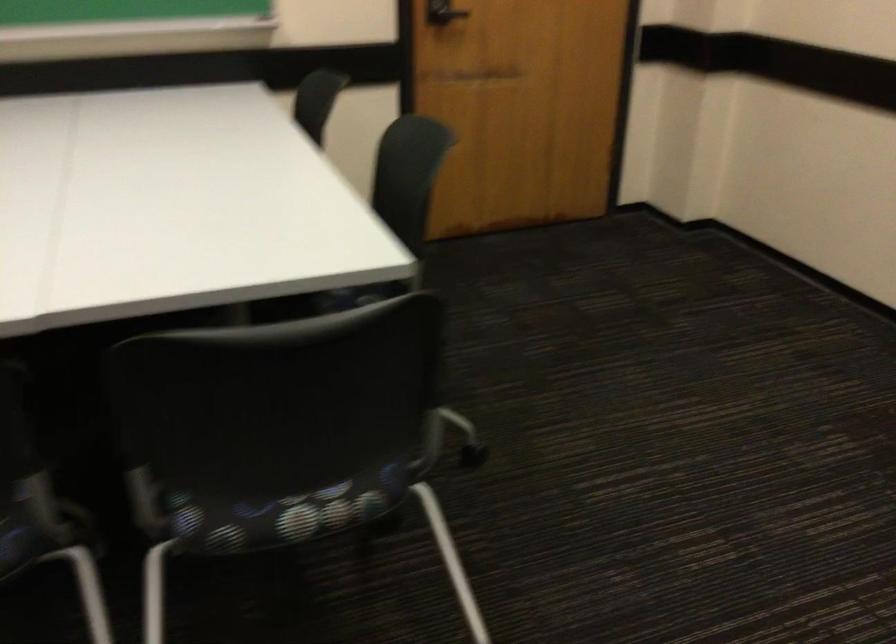
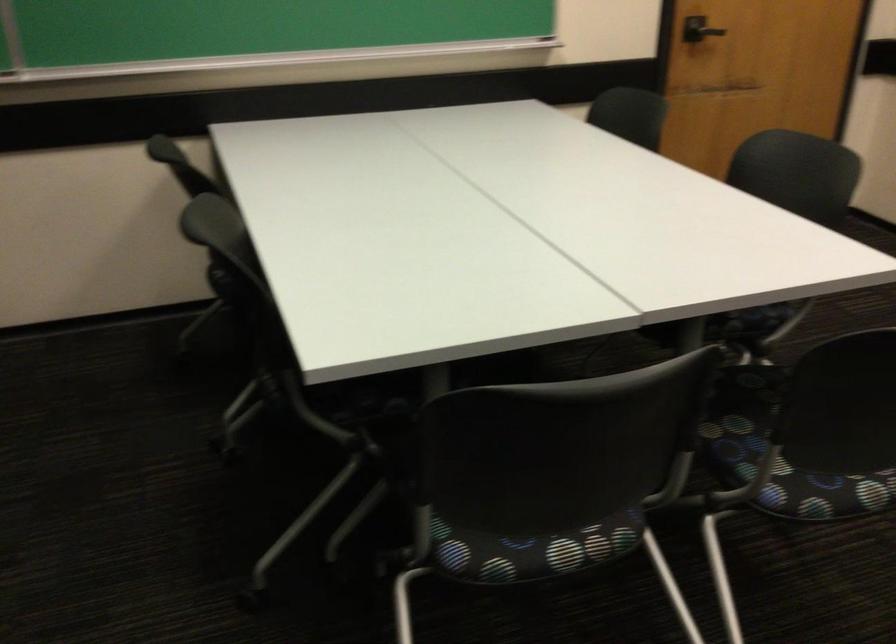
Find the pixel in the second image that matches (245,515) in the first image.

(823, 493)